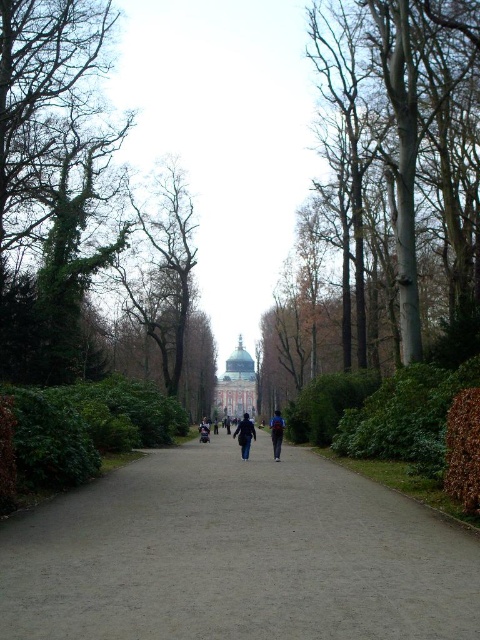
Question: Can you confirm if green leafy hedge at lower left is positioned to the right of dark blue jacket at center?

Choices:
 (A) no
 (B) yes

Answer: (A)

Question: Can you confirm if gray gravel path at center is thinner than brown smooth tree at center?

Choices:
 (A) no
 (B) yes

Answer: (B)

Question: Among these objects, which one is farthest from the camera?

Choices:
 (A) gray gravel path at center
 (B) green leafy hedge at lower left
 (C) dark blue jeans at center
 (D) matte gold dome at center

Answer: (D)

Question: Which point is farther from the camera taking this photo?

Choices:
 (A) (274, 449)
 (B) (195, 440)
 (C) (331, 336)
 (D) (251, 355)

Answer: (D)

Question: From the image, what is the correct spatial relationship of brown smooth tree at center in relation to green leafy hedge at lower left?

Choices:
 (A) right
 (B) left

Answer: (A)

Question: Among these points, which one is nearest to the camera?

Choices:
 (A) (41, 468)
 (B) (342, 132)
 (C) (317, 618)
 (D) (276, 454)

Answer: (C)